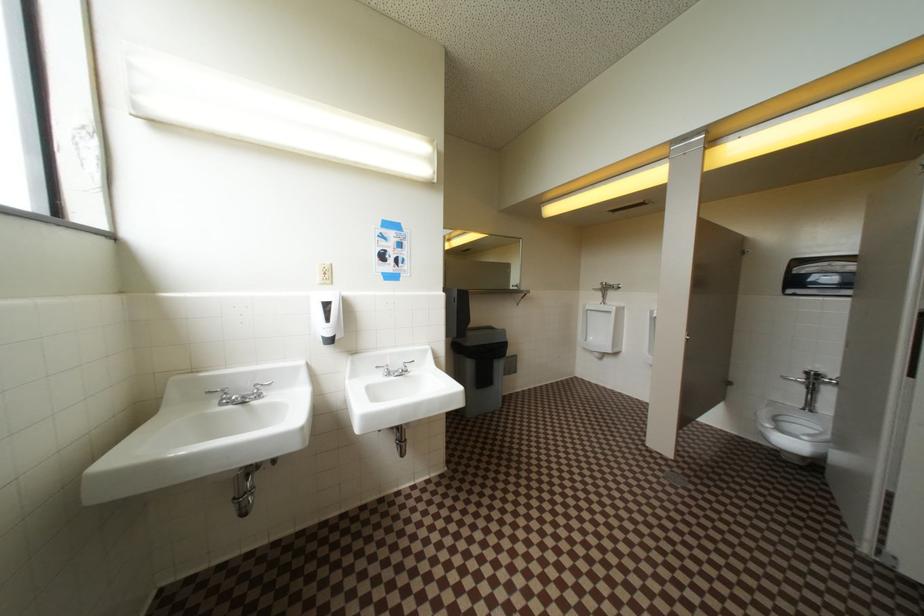
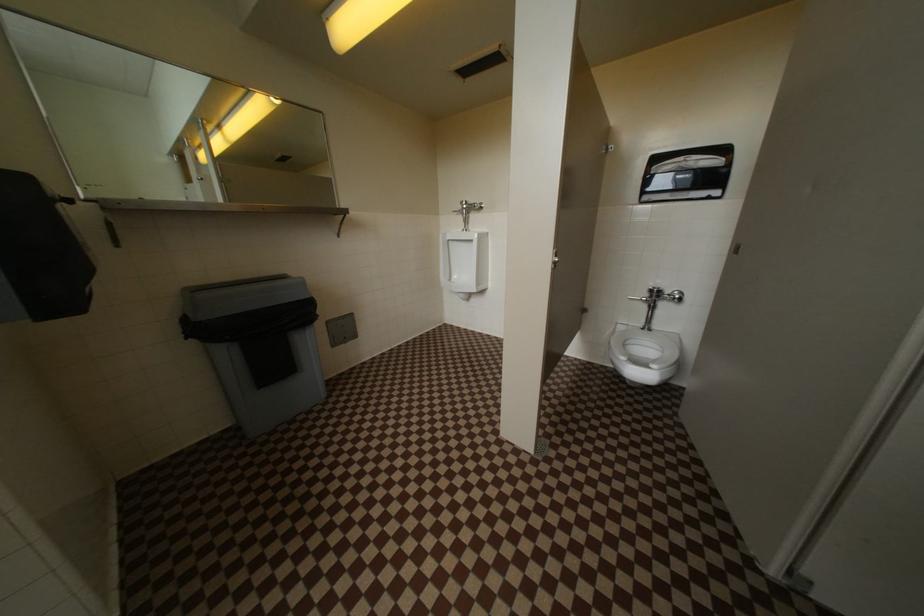
In a continuous first-person perspective shot, in which direction is the camera moving?

The movement direction of the cameraman is right, forward.